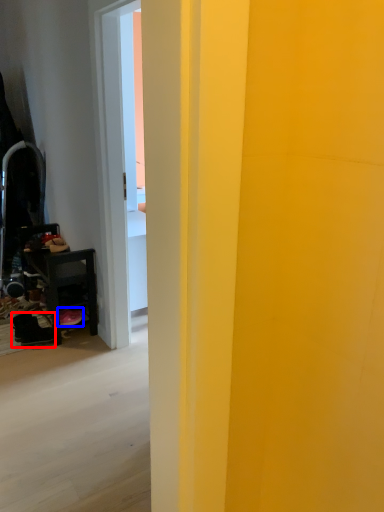
Question: Among these objects, which one is nearest to the camera, footwear (highlighted by a red box) or footwear (highlighted by a blue box)?

Choices:
 (A) footwear
 (B) footwear

Answer: (A)